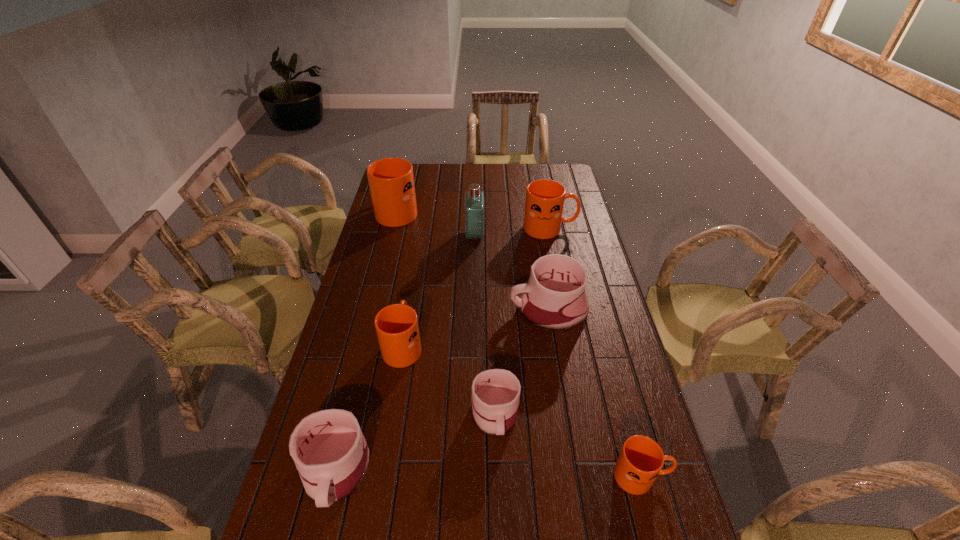
Where is `object that is the sixth nearest to the nearest orange mug`? The image size is (960, 540). object that is the sixth nearest to the nearest orange mug is located at coordinates (474, 205).

Locate which mug is the fifth closest to the perfume. Please provide its 2D coordinates. Your answer should be formatted as a tuple, i.e. [(x, y)], where the tuple contains the x and y coordinates of a point satisfying the conditions above.

[(495, 393)]

Image resolution: width=960 pixels, height=540 pixels. What are the coordinates of `the sixth closest mug to the perfume` in the screenshot? It's located at (331, 455).

Point out which orange mug is positioned as the third nearest to the sixth shortest object. Please provide its 2D coordinates. Your answer should be formatted as a tuple, i.e. [(x, y)], where the tuple contains the x and y coordinates of a point satisfying the conditions above.

[(641, 459)]

Identify which orange mug is the nearest to the perfume. Please provide its 2D coordinates. Your answer should be formatted as a tuple, i.e. [(x, y)], where the tuple contains the x and y coordinates of a point satisfying the conditions above.

[(544, 204)]

The height and width of the screenshot is (540, 960). In order to click on white mug that is the second nearest to the leftmost white mug in this screenshot , I will do `click(554, 298)`.

Choose which white mug is the third nearest neighbor to the biggest orange mug. Please provide its 2D coordinates. Your answer should be formatted as a tuple, i.e. [(x, y)], where the tuple contains the x and y coordinates of a point satisfying the conditions above.

[(331, 455)]

The width and height of the screenshot is (960, 540). Find the location of `free space that satisfies the following two spatial constraints: 1. on the front label of the perfume; 2. on the side with the handle of the leftmost white mug`. free space that satisfies the following two spatial constraints: 1. on the front label of the perfume; 2. on the side with the handle of the leftmost white mug is located at coordinates (471, 470).

Where is `free location that satisfies the following two spatial constraints: 1. on the side with the handle of the farthest white mug; 2. on the side with the handle of the smallest white mug`? The image size is (960, 540). free location that satisfies the following two spatial constraints: 1. on the side with the handle of the farthest white mug; 2. on the side with the handle of the smallest white mug is located at coordinates (564, 414).

Locate an element on the screen. vacant space that satisfies the following two spatial constraints: 1. on the handle side of the second biggest orange mug; 2. on the side with the handle of the smallest white mug is located at coordinates (588, 414).